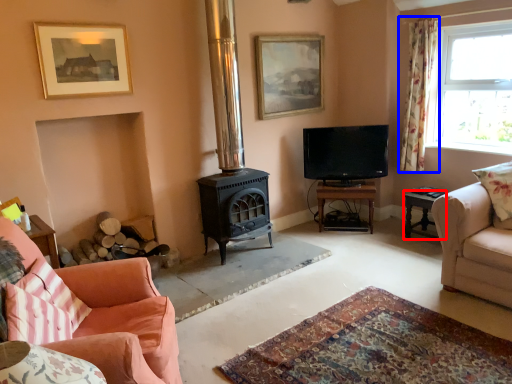
Question: Which point is closer to the camera, table (highlighted by a red box) or curtain (highlighted by a blue box)?

Choices:
 (A) table
 (B) curtain

Answer: (A)